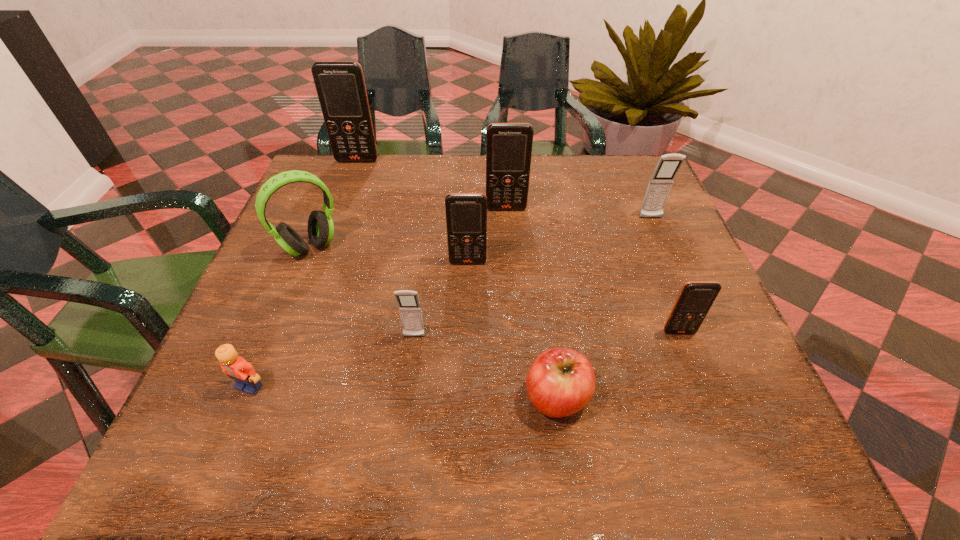
Find the location of `vacant space that satisfies the following two spatial constraints: 1. on the front-facing side of the Lego; 2. on the left side of the apple`. vacant space that satisfies the following two spatial constraints: 1. on the front-facing side of the Lego; 2. on the left side of the apple is located at coordinates [245, 398].

The image size is (960, 540). I want to click on vacant point that satisfies the following two spatial constraints: 1. on the screen of the leftmost cellular telephone; 2. on the left side of the red apple, so click(272, 398).

The image size is (960, 540). What are the coordinates of `free region that satisfies the following two spatial constraints: 1. on the screen of the apple; 2. on the right side of the leftmost cellular telephone` in the screenshot? It's located at (272, 398).